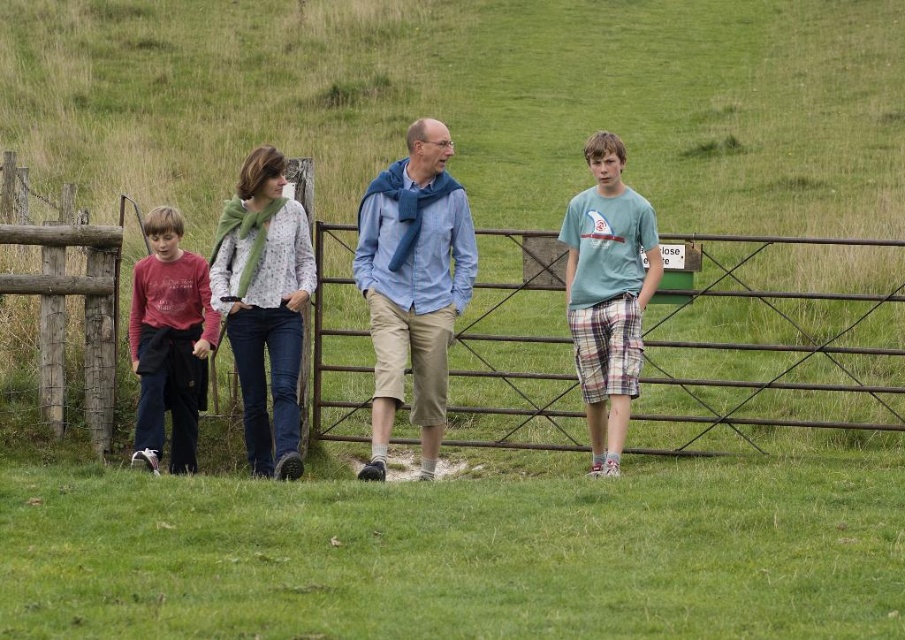
Question: Among these points, which one is farthest from the camera?

Choices:
 (A) (650, 268)
 (B) (358, 264)
 (C) (145, 392)

Answer: (A)

Question: Does blue cotton scarf at center appear on the right side of matte red shirt at left?

Choices:
 (A) yes
 (B) no

Answer: (A)

Question: Is blue cotton scarf at center thinner than light blue t-shirt at center?

Choices:
 (A) no
 (B) yes

Answer: (A)

Question: Which point is closer to the camera taking this photo?

Choices:
 (A) (337, 436)
 (B) (634, 349)

Answer: (B)

Question: Which point appears farthest from the camera in this image?

Choices:
 (A) (583, 358)
 (B) (421, 323)
 (C) (154, 236)

Answer: (C)

Question: Can you confirm if blue cotton scarf at center is wider than matte red shirt at left?

Choices:
 (A) no
 (B) yes

Answer: (B)